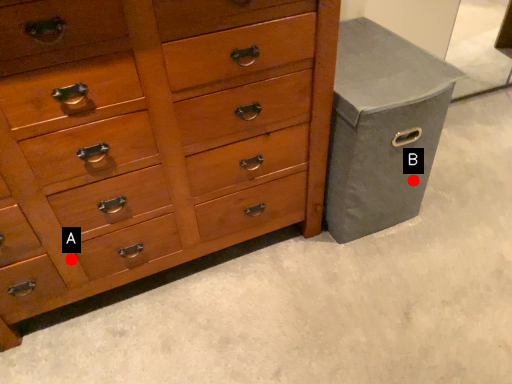
Question: Two points are circled on the image, labeled by A and B beside each circle. Which of the following is the closest to the observer?

Choices:
 (A) A is closer
 (B) B is closer

Answer: (A)